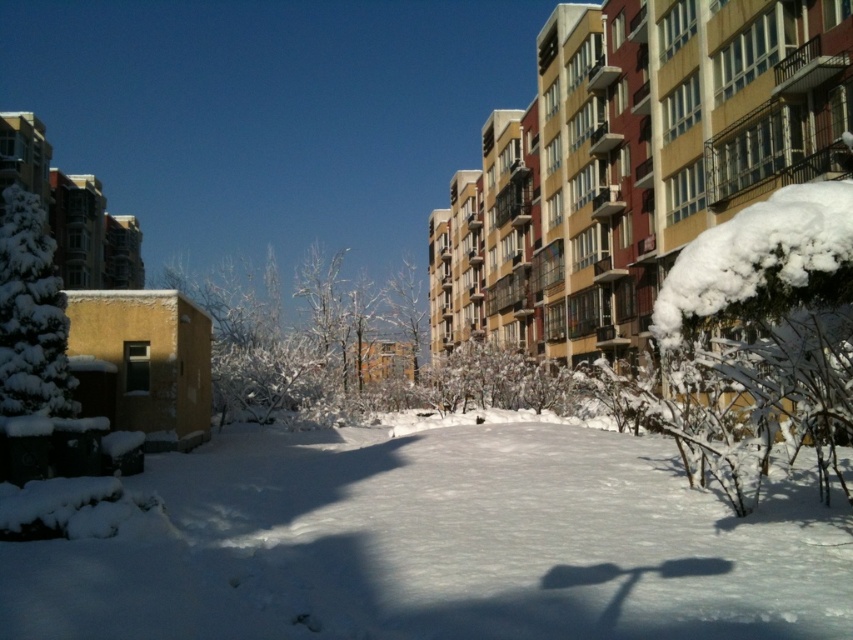
Question: Can you confirm if white fluffy snow at center is smaller than green fluffy tree at left?

Choices:
 (A) yes
 (B) no

Answer: (B)

Question: Which of the following is the closest to the observer?

Choices:
 (A) (355, 288)
 (B) (16, 246)
 (C) (811, 250)

Answer: (C)

Question: Among these points, which one is nearest to the camera?

Choices:
 (A) (775, 212)
 (B) (38, 625)

Answer: (A)

Question: Does white fluffy snow at lower right have a smaller size compared to green fluffy tree at left?

Choices:
 (A) yes
 (B) no

Answer: (A)

Question: Based on their relative distances, which object is farther from the white fluffy snow at lower right?

Choices:
 (A) white frosty tree at center
 (B) white fluffy snow at center

Answer: (A)

Question: Can you confirm if white fluffy snow at center is wider than green fluffy tree at left?

Choices:
 (A) yes
 (B) no

Answer: (A)